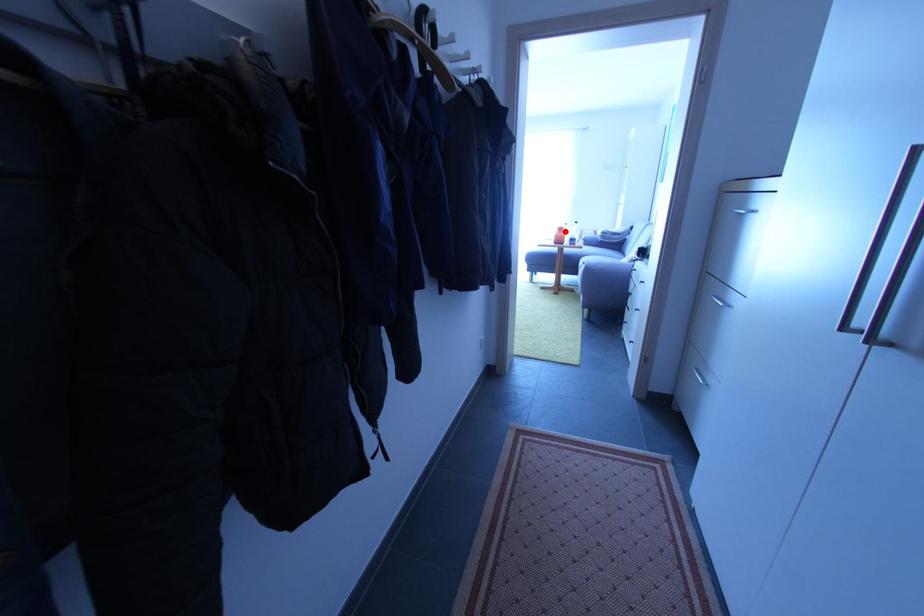
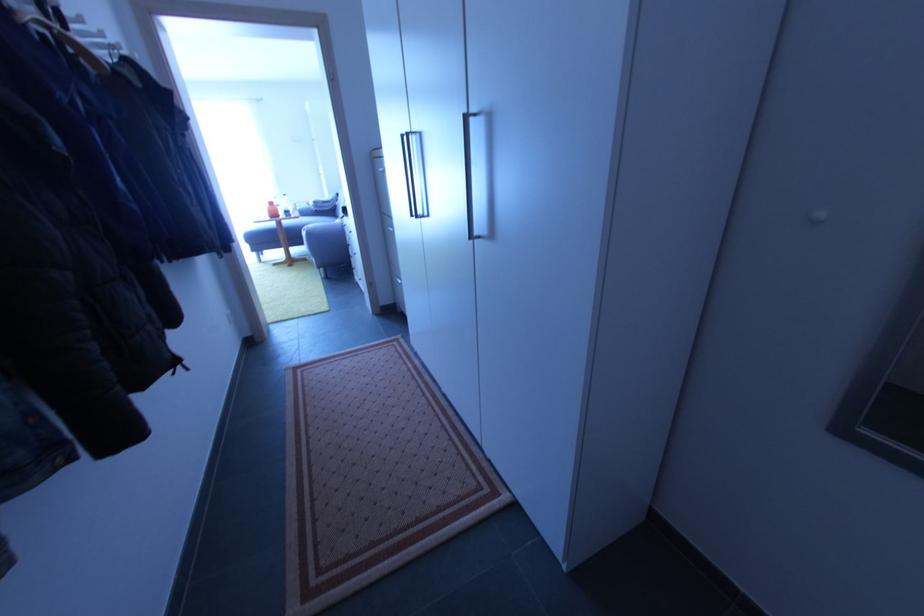
Question: I am providing you with two images of the same scene from different viewpoints. A red point is marked on the first image. At the location where the point appears in image 1, is it still visible in image 2?

Choices:
 (A) Yes
 (B) No

Answer: (A)